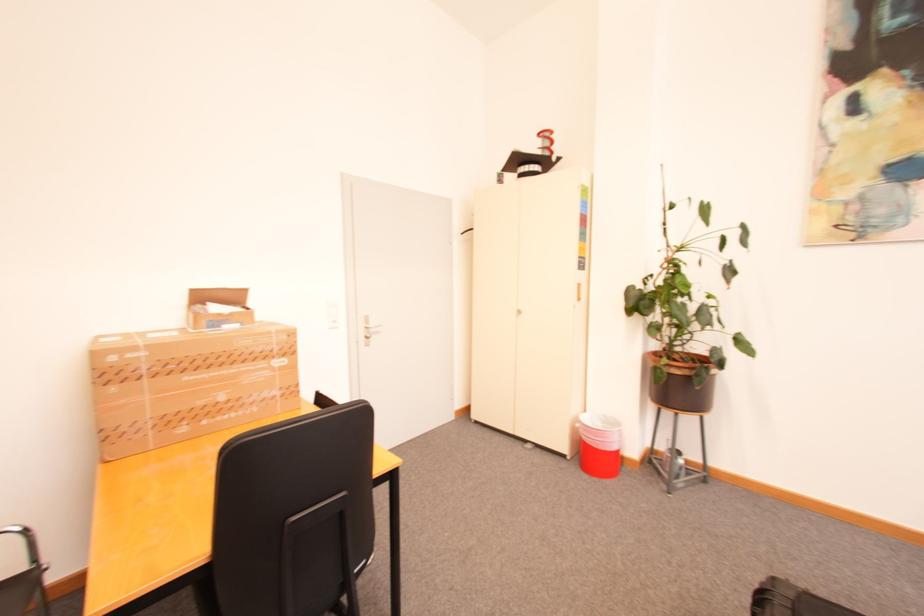
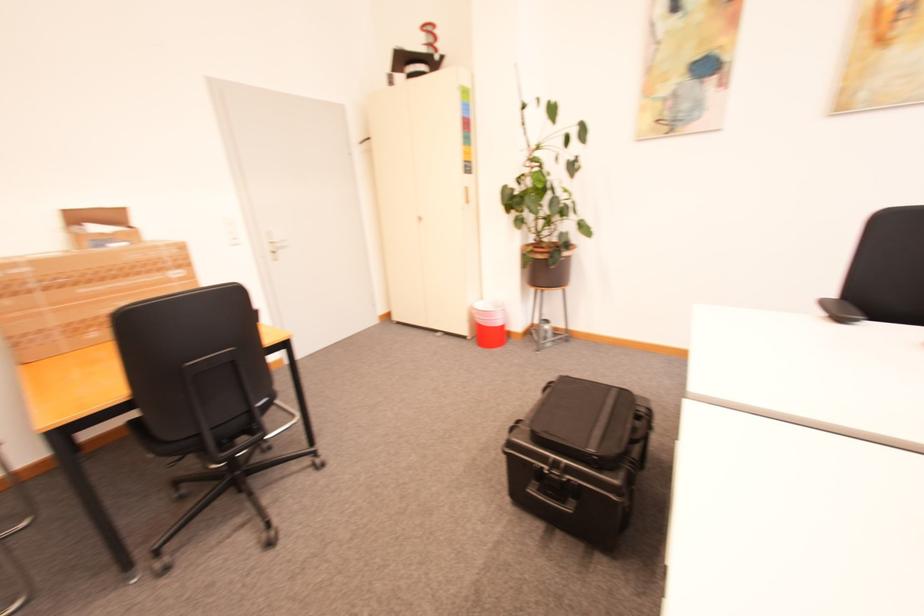
Which direction would the cameraman need to move to produce the second image?

The cameraman walked toward right, backward.